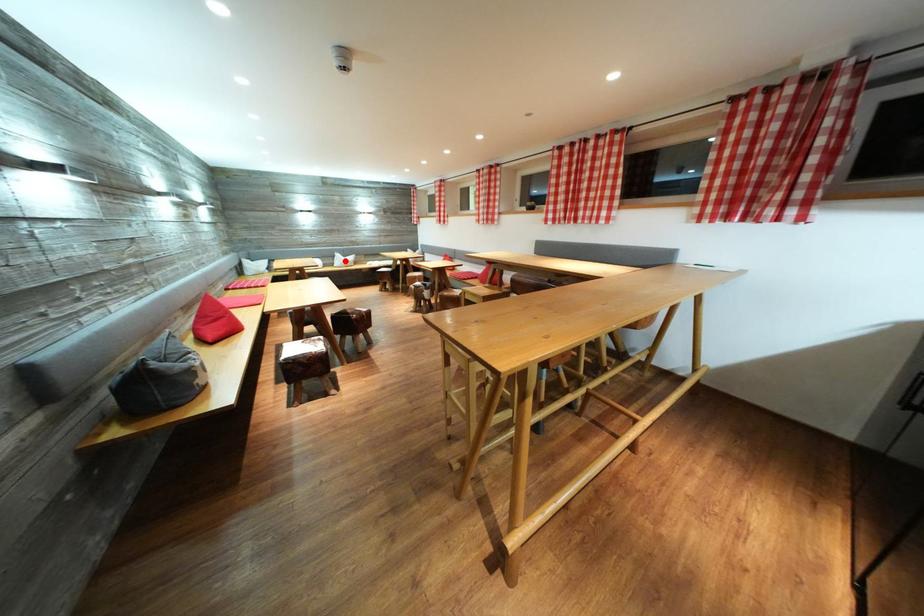
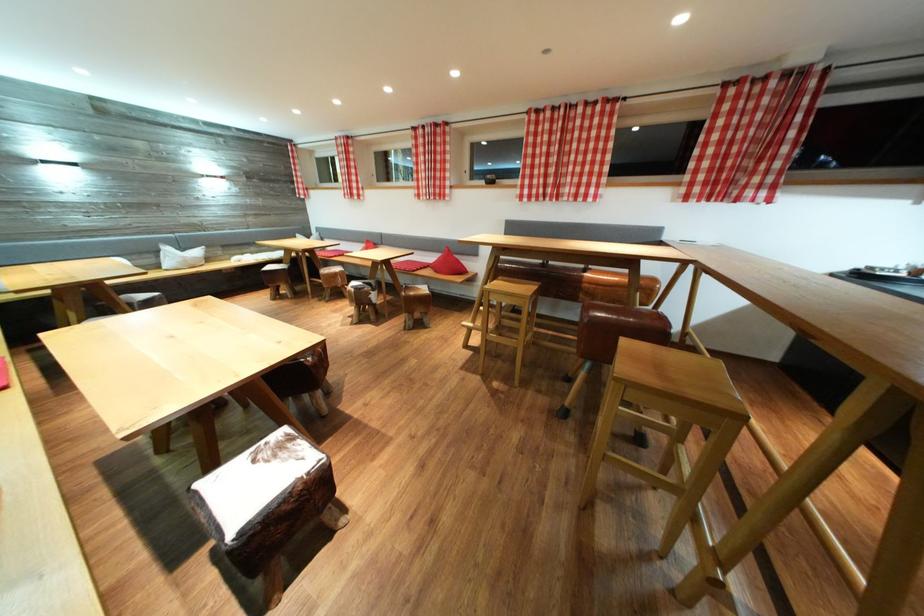
Where in the second image is the point corresponding to the highlighted location from the first image?

(176, 254)